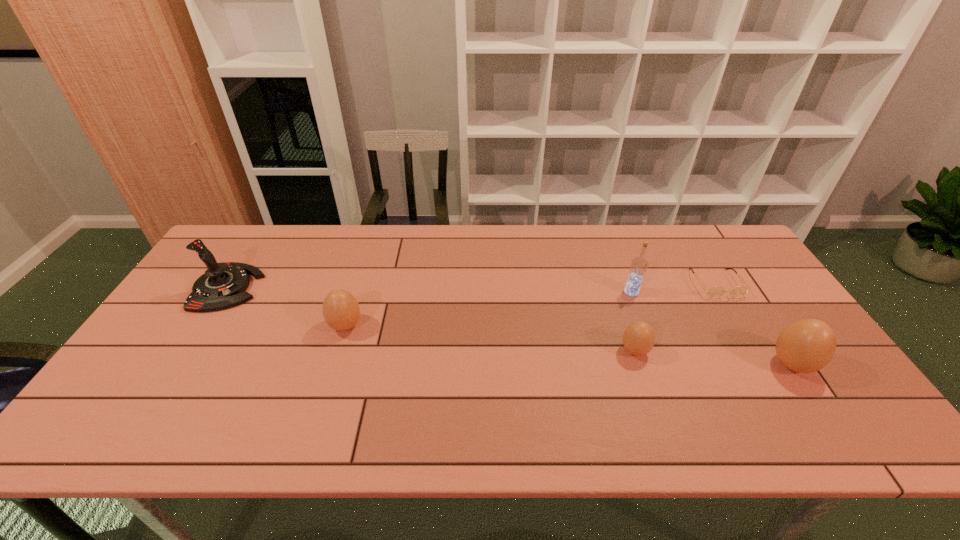
You are a GUI agent. You are given a task and a screenshot of the screen. Output one action in this format:
    pyautogui.click(x=<x>, y=<y>)
    Task: Click on the free space located on the back of the second boiled egg from left to right
    The width and height of the screenshot is (960, 540).
    Given the screenshot: What is the action you would take?
    (x=622, y=313)

What are the coordinates of `free space located 0.180m on the back of the tallest boiled egg` in the screenshot? It's located at (750, 300).

Identify the location of vacant area situated 0.100m on the handle side of the joystick. (293, 288).

At what (x,y) coordinates should I click in order to perform the action: click on vacant space located on the lenses of the spectacles. Please return your answer as a coordinate pair (x, y). Looking at the image, I should click on (741, 327).

I want to click on vacant space located on the left of the vodka, so click(x=554, y=292).

Image resolution: width=960 pixels, height=540 pixels. Identify the location of joystick located in the far edge section of the desktop. (223, 285).

You are a GUI agent. You are given a task and a screenshot of the screen. Output one action in this format:
    pyautogui.click(x=<x>, y=<y>)
    Task: Click on the spectacles that is at the far edge
    
    Given the screenshot: What is the action you would take?
    pyautogui.click(x=714, y=292)

You are a GUI agent. You are given a task and a screenshot of the screen. Output one action in this format:
    pyautogui.click(x=<x>, y=<y>)
    Task: Click on the object at the near edge
    
    Given the screenshot: What is the action you would take?
    pyautogui.click(x=808, y=345)

In order to click on object positioned at the left edge in this screenshot , I will do `click(223, 285)`.

Identify the location of boiled egg located in the right edge section of the desktop. (808, 345).